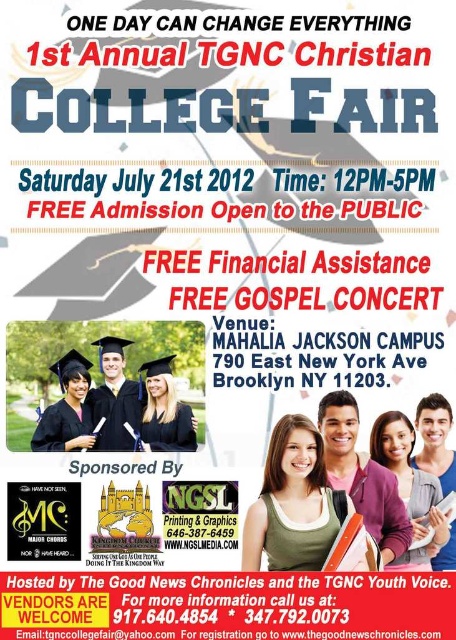
In the poster for the 1st Annual TGNC Christian College Fair, there is a point labeled as point [362,476]. What object is located at that point?

The point [362,476] corresponds to the matte black jacket at center.